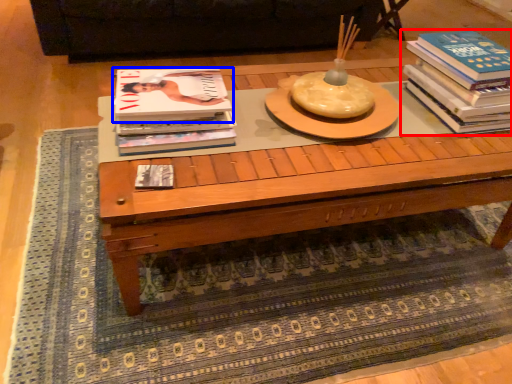
Question: Which object appears closest to the camera in this image, book (highlighted by a red box) or book (highlighted by a blue box)?

Choices:
 (A) book
 (B) book

Answer: (B)